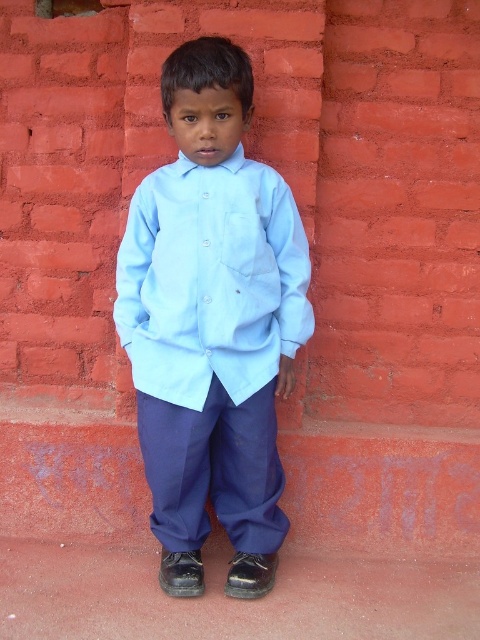
Is point (216, 248) farther from camera compared to point (192, 193)?

No, it is not.

Is light blue cotton shirt at center wider than light blue cotton dress shirt at center?

In fact, light blue cotton shirt at center might be narrower than light blue cotton dress shirt at center.

Which is behind, point (180, 400) or point (257, 259)?

The point (180, 400) is more distant.

At what (x,y) coordinates should I click in order to perform the action: click on light blue cotton shirt at center. Please return your answer as a coordinate pair (x, y). The height and width of the screenshot is (640, 480). Looking at the image, I should click on (212, 323).

Who is positioned more to the left, light blue cotton shirt at center or navy blue cotton pants at center?

From the viewer's perspective, light blue cotton shirt at center appears more on the left side.

This screenshot has width=480, height=640. What do you see at coordinates (212, 323) in the screenshot? I see `light blue cotton shirt at center` at bounding box center [212, 323].

Locate an element on the screen. This screenshot has height=640, width=480. light blue cotton shirt at center is located at coordinates (212, 323).

Is light blue cotton dress shirt at center in front of navy blue cotton pants at center?

Yes, it is.

Who is more distant from viewer, (x=135, y=218) or (x=271, y=394)?

The point (x=135, y=218) is more distant.

Which is behind, point (199, 269) or point (169, 513)?

Point (169, 513)

Locate an element on the screen. The image size is (480, 640). light blue cotton dress shirt at center is located at coordinates (211, 280).